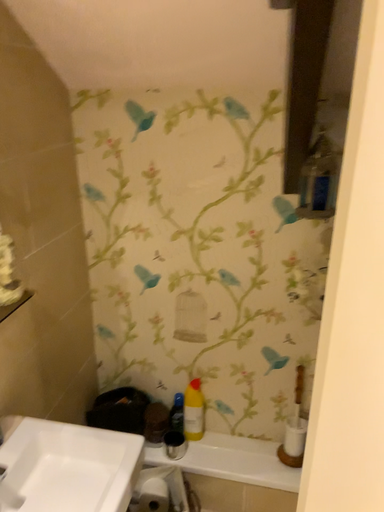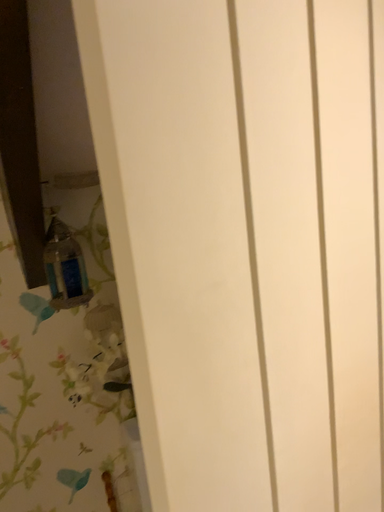
Question: How did the camera likely rotate when shooting the video?

Choices:
 (A) rotated left
 (B) rotated right

Answer: (B)